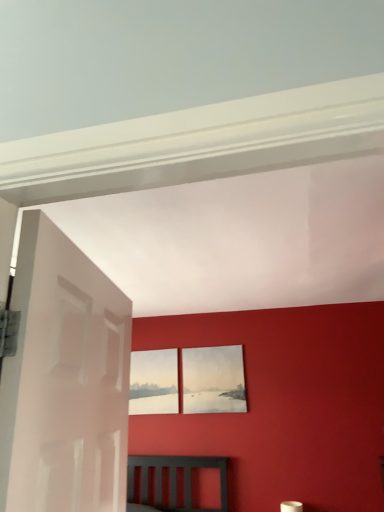
Image resolution: width=384 pixels, height=512 pixels. Describe the element at coordinates (213, 380) in the screenshot. I see `matte paper picture frame at center, which appears as the 2th picture frame when viewed from the left` at that location.

You are a GUI agent. You are given a task and a screenshot of the screen. Output one action in this format:
    pyautogui.click(x=<x>, y=<y>)
    Task: Click on the matte white picture frame at center, marked as the 1th picture frame in a left-to-right arrangement
    This screenshot has width=384, height=512.
    Given the screenshot: What is the action you would take?
    pyautogui.click(x=154, y=382)

Locate an element on the screen. The image size is (384, 512). picture frame on the left of white glossy door at left is located at coordinates (154, 382).

Can you confirm if white glossy door at left is wider than matte white picture frame at center, marked as the 1th picture frame in a left-to-right arrangement?

Yes.

Does point (31, 345) lie behind point (131, 388)?

No.

From the picture: Is white glossy door at left with matte white picture frame at center, the 2th picture frame from the right?

They are not placed beside each other.

From a real-world perspective, which is physically above, matte white picture frame at center, marked as the 1th picture frame in a left-to-right arrangement, or matte paper picture frame at center, which appears as the 2th picture frame when viewed from the left?

In real-world perspective, matte white picture frame at center, marked as the 1th picture frame in a left-to-right arrangement, is above.

Is matte white picture frame at center, the 2th picture frame from the right, oriented towards matte paper picture frame at center, the 1th picture frame viewed from the right?

No, matte white picture frame at center, the 2th picture frame from the right, is not aimed at matte paper picture frame at center, the 1th picture frame viewed from the right.

Does matte white picture frame at center, marked as the 1th picture frame in a left-to-right arrangement, have a larger size compared to matte paper picture frame at center, the 1th picture frame viewed from the right?

Actually, matte white picture frame at center, marked as the 1th picture frame in a left-to-right arrangement, might be smaller than matte paper picture frame at center, the 1th picture frame viewed from the right.

Where is `door above the matte paper picture frame at center, the 1th picture frame viewed from the right (from the image's perspective)`? The height and width of the screenshot is (512, 384). door above the matte paper picture frame at center, the 1th picture frame viewed from the right (from the image's perspective) is located at coordinates (64, 380).

Can you confirm if matte paper picture frame at center, the 1th picture frame viewed from the right, is smaller than white glossy door at left?

Correct, matte paper picture frame at center, the 1th picture frame viewed from the right, occupies less space than white glossy door at left.

Can you tell me how much matte paper picture frame at center, which appears as the 2th picture frame when viewed from the left, and white glossy door at left differ in facing direction?

The angle between the facing direction of matte paper picture frame at center, which appears as the 2th picture frame when viewed from the left, and the facing direction of white glossy door at left is 98.7 degrees.

Is matte white picture frame at center, the 2th picture frame from the right, oriented towards white glossy door at left?

Yes, matte white picture frame at center, the 2th picture frame from the right, is aimed at white glossy door at left.

Considering the sizes of matte white picture frame at center, the 2th picture frame from the right, and white glossy door at left in the image, is matte white picture frame at center, the 2th picture frame from the right, taller or shorter than white glossy door at left?

matte white picture frame at center, the 2th picture frame from the right, is shorter than white glossy door at left.

Which point is more distant from viewer, [130,387] or [6,488]?

The point [130,387] is farther from the camera.

Looking at this image, from the image's perspective, is matte white picture frame at center, the 2th picture frame from the right, beneath white glossy door at left?

Yes.

Does white glossy door at left have a greater height compared to matte paper picture frame at center, the 1th picture frame viewed from the right?

Indeed, white glossy door at left has a greater height compared to matte paper picture frame at center, the 1th picture frame viewed from the right.

In the scene shown: Between white glossy door at left and matte paper picture frame at center, the 1th picture frame viewed from the right, which one has larger size?

white glossy door at left is bigger.

Between point (35, 289) and point (200, 358), which one is positioned behind?

The point (200, 358) is more distant.

Is white glossy door at left next to matte paper picture frame at center, which appears as the 2th picture frame when viewed from the left, and touching it?

No, white glossy door at left is not with matte paper picture frame at center, which appears as the 2th picture frame when viewed from the left.

From the image's perspective, is matte paper picture frame at center, which appears as the 2th picture frame when viewed from the left, above or below matte white picture frame at center, marked as the 1th picture frame in a left-to-right arrangement?

Clearly, from the image's perspective, matte paper picture frame at center, which appears as the 2th picture frame when viewed from the left, is above matte white picture frame at center, marked as the 1th picture frame in a left-to-right arrangement.

In order to click on picture frame below the matte white picture frame at center, the 2th picture frame from the right (from a real-world perspective) in this screenshot , I will do `click(213, 380)`.

From the picture: How many degrees apart are the facing directions of matte paper picture frame at center, which appears as the 2th picture frame when viewed from the left, and matte white picture frame at center, the 2th picture frame from the right?

The angle between the facing direction of matte paper picture frame at center, which appears as the 2th picture frame when viewed from the left, and the facing direction of matte white picture frame at center, the 2th picture frame from the right, is 0.00492 degrees.

I want to click on door beneath the matte white picture frame at center, marked as the 1th picture frame in a left-to-right arrangement (from a real-world perspective), so click(64, 380).

This screenshot has width=384, height=512. I want to click on picture frame below the matte paper picture frame at center, which appears as the 2th picture frame when viewed from the left (from the image's perspective), so click(x=154, y=382).

Which object lies nearer to the anchor point white glossy door at left, matte white picture frame at center, marked as the 1th picture frame in a left-to-right arrangement, or matte paper picture frame at center, the 1th picture frame viewed from the right?

matte paper picture frame at center, the 1th picture frame viewed from the right, is closer to white glossy door at left.

When comparing their distances from white glossy door at left, does matte paper picture frame at center, the 1th picture frame viewed from the right, or matte white picture frame at center, the 2th picture frame from the right, seem further?

matte white picture frame at center, the 2th picture frame from the right, is positioned further to the anchor white glossy door at left.

Which object lies further to the anchor point matte paper picture frame at center, the 1th picture frame viewed from the right, white glossy door at left or matte white picture frame at center, the 2th picture frame from the right?

white glossy door at left is further to matte paper picture frame at center, the 1th picture frame viewed from the right.

Estimate the real-world distances between objects in this image. Which object is further from matte paper picture frame at center, which appears as the 2th picture frame when viewed from the left, matte white picture frame at center, the 2th picture frame from the right, or white glossy door at left?

Based on the image, white glossy door at left appears to be further to matte paper picture frame at center, which appears as the 2th picture frame when viewed from the left.

Estimate the real-world distances between objects in this image. Which object is closer to matte white picture frame at center, marked as the 1th picture frame in a left-to-right arrangement, white glossy door at left or matte paper picture frame at center, the 1th picture frame viewed from the right?

matte paper picture frame at center, the 1th picture frame viewed from the right.

When comparing their distances from matte white picture frame at center, marked as the 1th picture frame in a left-to-right arrangement, does matte paper picture frame at center, the 1th picture frame viewed from the right, or white glossy door at left seem further?

white glossy door at left is positioned further to the anchor matte white picture frame at center, marked as the 1th picture frame in a left-to-right arrangement.

The height and width of the screenshot is (512, 384). Find the location of `picture frame positioned between white glossy door at left and matte white picture frame at center, marked as the 1th picture frame in a left-to-right arrangement, from near to far`. picture frame positioned between white glossy door at left and matte white picture frame at center, marked as the 1th picture frame in a left-to-right arrangement, from near to far is located at coordinates (213, 380).